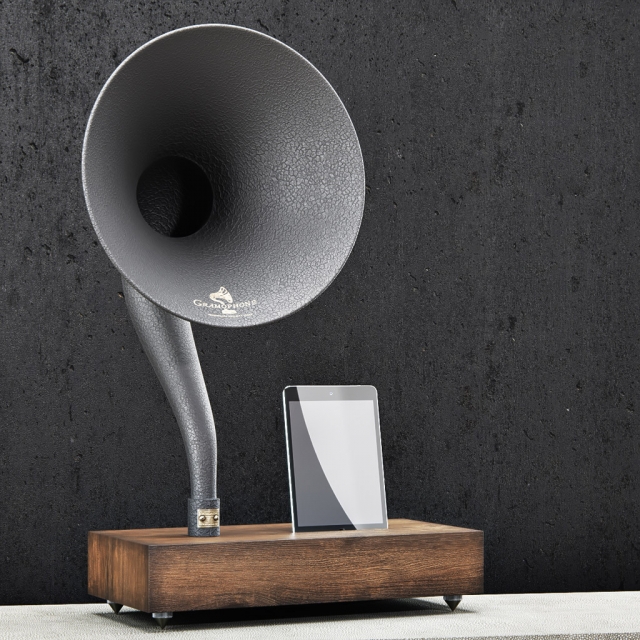
In order to click on white inside object on brown box in this screenshot , I will do `click(339, 451)`.